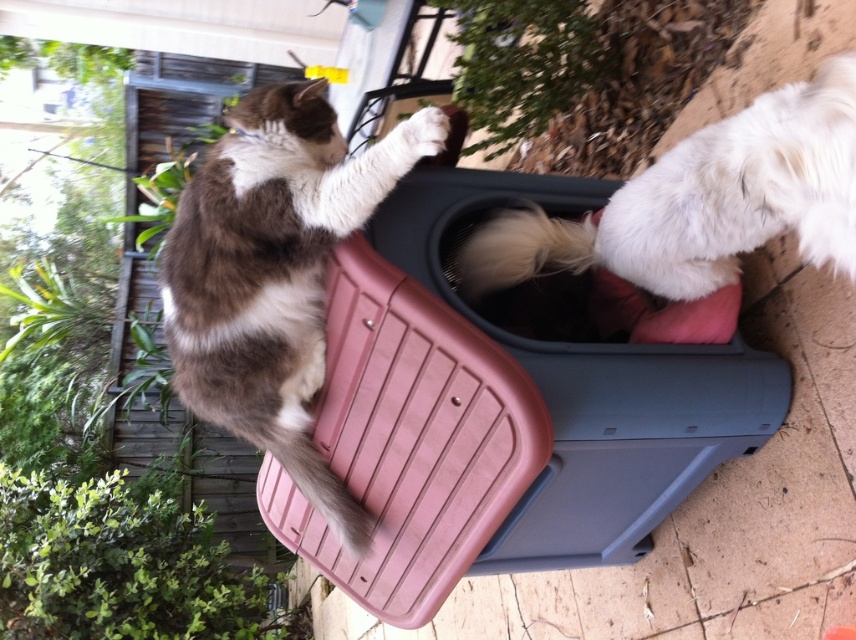
You are a photographer setting up a camera on a tripod. The camera needs to capture both the white fluffy dog at upper right and the blonde fur tail at center without any overlap. Given the camera has a fixed wide angle lens, which animal should you position closer to the camera to avoid overlap?

To avoid overlap between the white fluffy dog at upper right and the blonde fur tail at center, position the white fluffy dog at upper right closer to the camera. Since the white fluffy dog at upper right might be wider than the blonde fur tail at center, bringing it nearer will help maintain their separation in the frame.